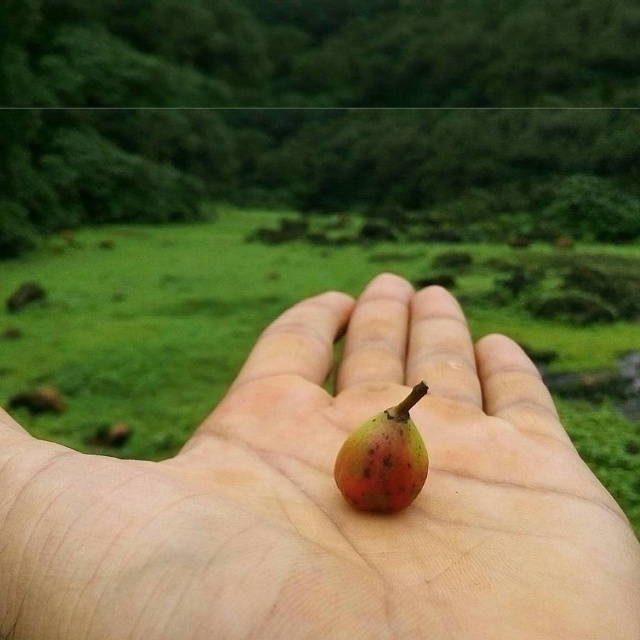
Is smooth skin palm at center closer to camera compared to ripe red-orange fruit at center?

That is True.

Does smooth skin palm at center have a larger size compared to ripe red-orange fruit at center?

Yes.

Who is more distant from viewer, (236, 483) or (349, 465)?

Point (349, 465)

Identify the location of smooth skin palm at center. The image size is (640, 640). (326, 502).